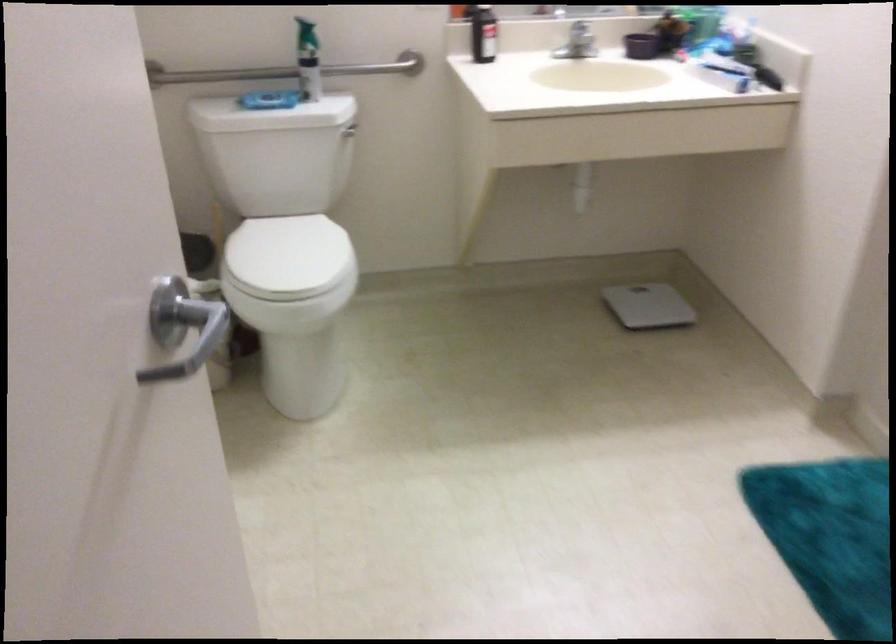
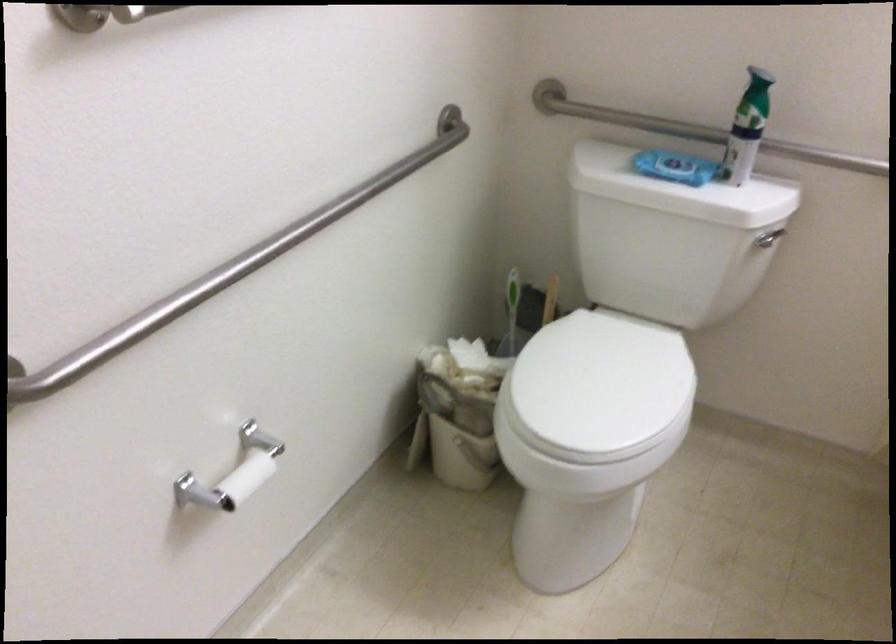
In the second image, find the point that corresponds to (x=273, y=73) in the first image.

(691, 129)